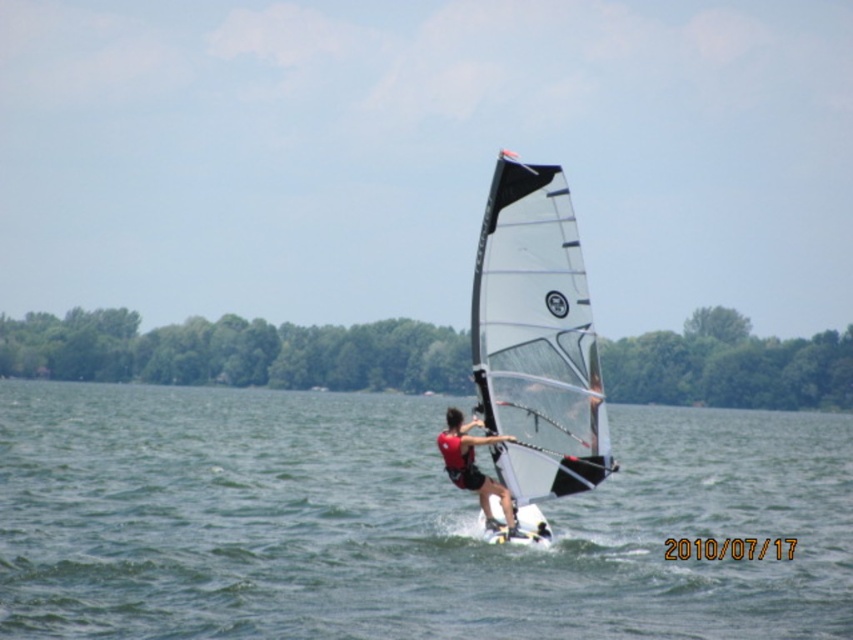
You are a safety inspector evaluating the windsurfer setup. The safety guidelines state that the distance between the clear water at center and red matte life vest at center must be less than 100 feet to ensure quick access to flotation devices. Is the current distance compliant with the guidelines?

The clear water at center and red matte life vest at center are 105.64 feet apart, which exceeds the 100 feet requirement. Therefore, the setup does not comply with the safety guidelines.

You are a photographer trying to capture the windsurfer. You notice the transparent plastic sail at center and the red matte life vest at center. Which object should you focus on if you want to capture the larger object in your shot?

The transparent plastic sail at center has a larger size compared to the red matte life vest at center, so focusing on the transparent plastic sail at center will capture the larger object in your shot.